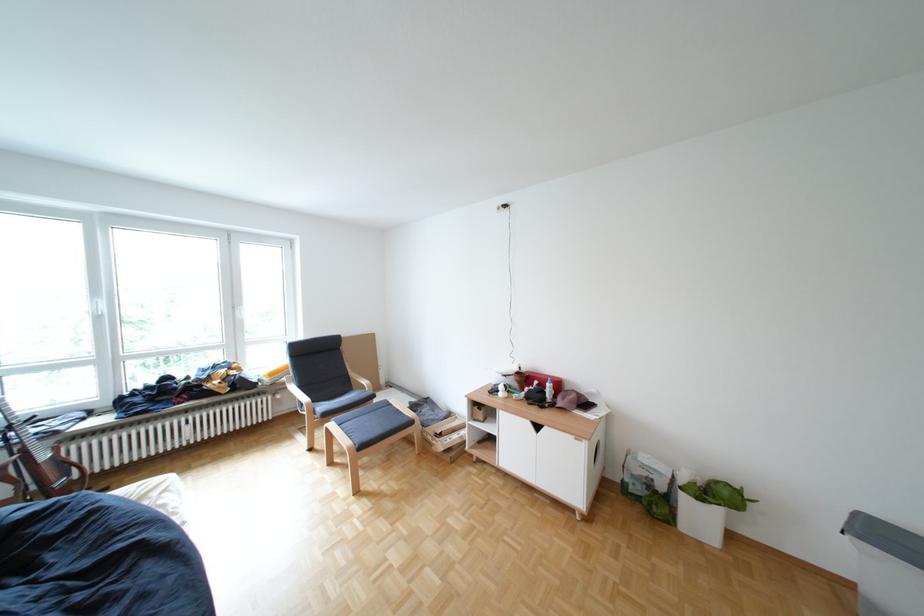
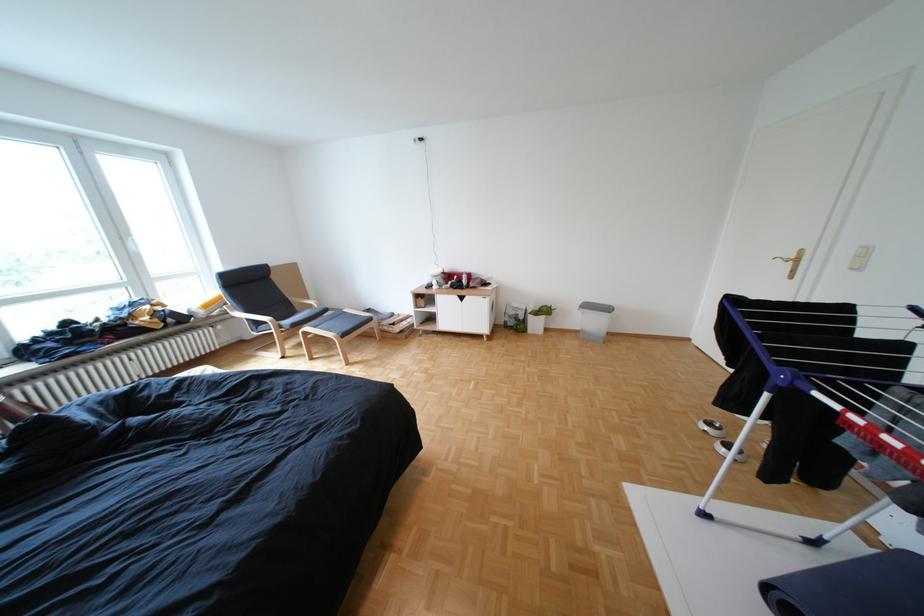
Locate, in the second image, the point that corresponds to [542,390] in the first image.

(466, 283)